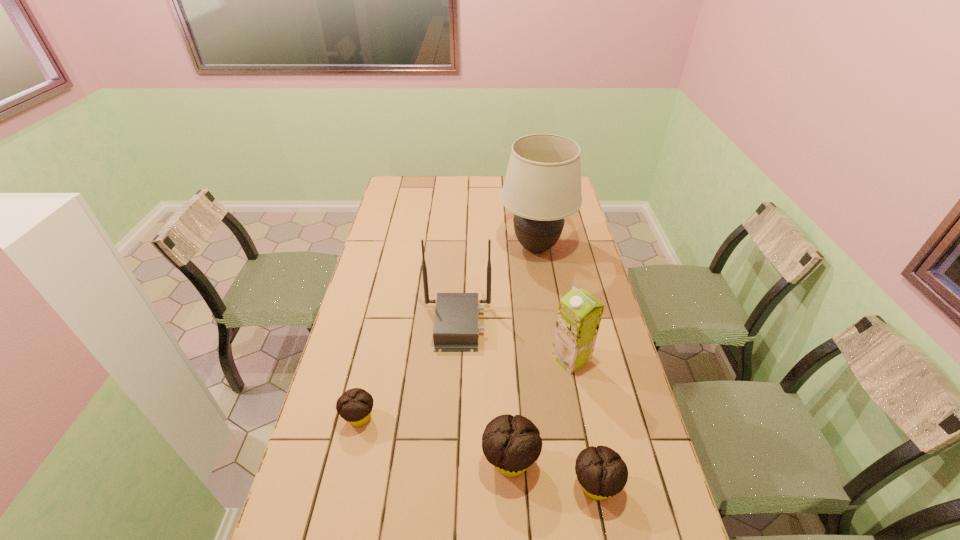
The width and height of the screenshot is (960, 540). Identify the location of vacant region that satisfies the following two spatial constraints: 1. on the back side of the lampshade; 2. on the left side of the fourth farthest object. (398, 248).

Locate an element on the screen. The width and height of the screenshot is (960, 540). free space that satisfies the following two spatial constraints: 1. on the back of the third shortest object to connect cables; 2. on the left side of the router is located at coordinates (450, 461).

This screenshot has width=960, height=540. What are the coordinates of `free space that satisfies the following two spatial constraints: 1. on the back of the second shortest object to connect cables; 2. on the left side of the router` in the screenshot? It's located at (448, 485).

Where is `vacant region that satisfies the following two spatial constraints: 1. on the back of the router to connect cables; 2. on the left side of the second muffin from left to right`? The image size is (960, 540). vacant region that satisfies the following two spatial constraints: 1. on the back of the router to connect cables; 2. on the left side of the second muffin from left to right is located at coordinates (450, 461).